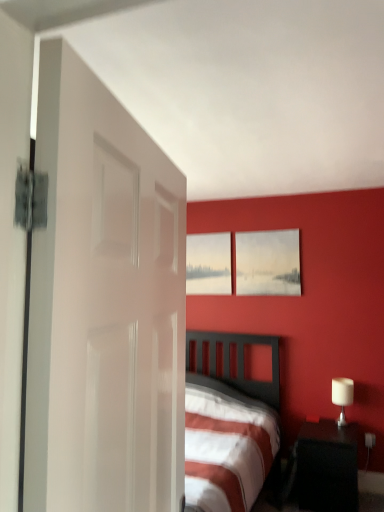
Question: Considering their positions, is matte white picture frame at upper center, the first picture frame when ordered from front to back, located in front of or behind matte gray picture frame at upper center, placed as the 2th picture frame when sorted from right to left?

Choices:
 (A) front
 (B) behind

Answer: (A)

Question: Is matte white picture frame at upper center, the first picture frame when ordered from front to back, taller or shorter than matte gray picture frame at upper center, which ranks as the 1th picture frame in left-to-right order?

Choices:
 (A) short
 (B) tall

Answer: (B)

Question: Which object is the closest to the white glossy door at left?

Choices:
 (A) matte gray picture frame at upper center, which ranks as the 1th picture frame in left-to-right order
 (B) matte white picture frame at upper center, the first picture frame when ordered from front to back
 (C) white glossy table lamp at right
 (D) black glossy nightstand at lower right

Answer: (D)

Question: Considering the real-world distances, which object is farthest from the white glossy door at left?

Choices:
 (A) matte gray picture frame at upper center, the first picture frame positioned from the back
 (B) white glossy table lamp at right
 (C) matte white picture frame at upper center, the 1th picture frame from the right
 (D) black glossy nightstand at lower right

Answer: (B)